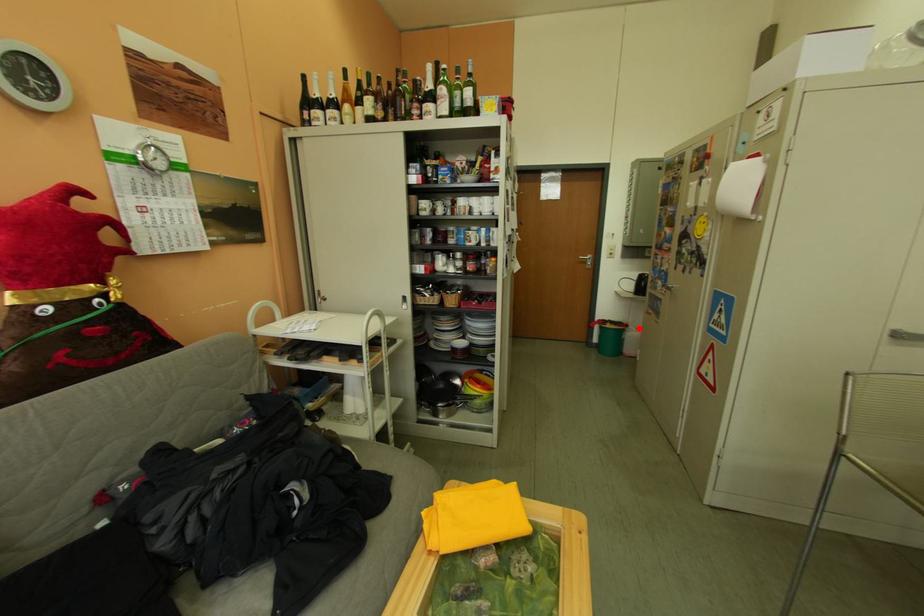
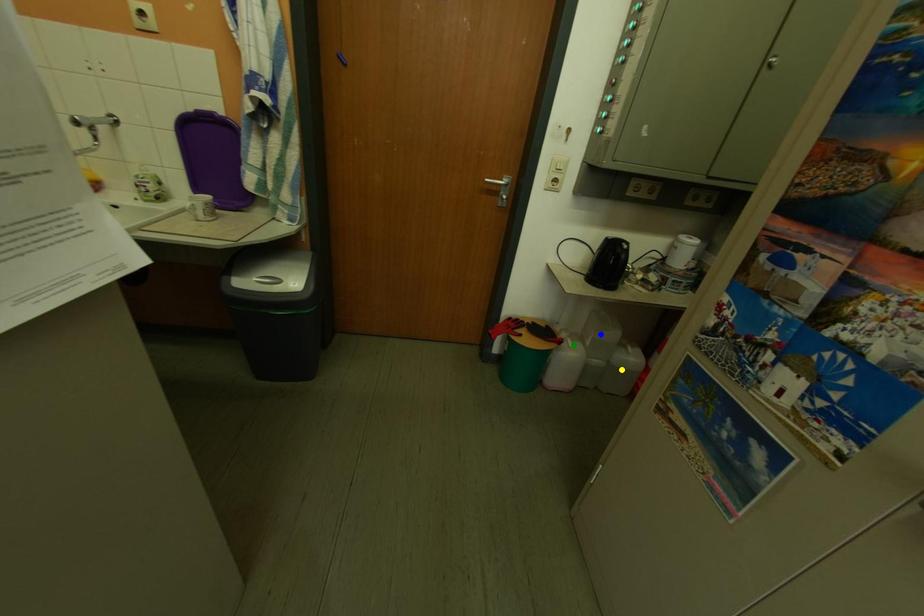
Question: I am providing you with two images of the same scene from different viewpoints. A red point is marked on the first image. You are given multiple points on the second image. Which spot in image 2 lines up with the point in image 1?

Choices:
 (A) blue point
 (B) yellow point
 (C) green point

Answer: (C)